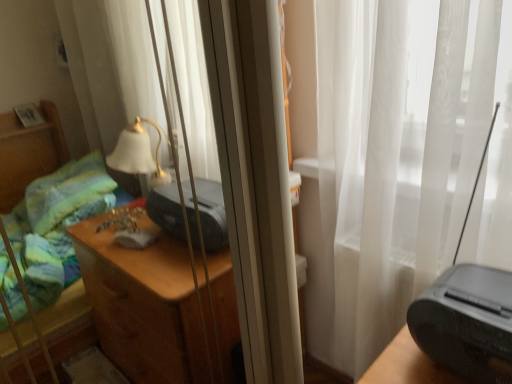
Question: From the image's perspective, is matte black printer at center, positioned as the 1th printer in left-to-right order, located above black plastic radio at right?

Choices:
 (A) yes
 (B) no

Answer: (A)

Question: Is matte black printer at center, arranged as the second printer when viewed from the front, positioned in front of black plastic radio at right?

Choices:
 (A) no
 (B) yes

Answer: (A)

Question: Does matte black printer at center, positioned as the 1th printer in left-to-right order, have a lesser height compared to black plastic radio at right?

Choices:
 (A) no
 (B) yes

Answer: (B)

Question: Is matte black printer at center, arranged as the second printer when viewed from the front, oriented away from black plastic radio at right?

Choices:
 (A) yes
 (B) no

Answer: (B)

Question: From a real-world perspective, is matte black printer at center, arranged as the 2th printer when viewed from the right, on top of black plastic radio at right?

Choices:
 (A) yes
 (B) no

Answer: (B)

Question: Relative to black plastic printer at right, which is counted as the 1th printer, starting from the front, is black plastic radio at right in front or behind?

Choices:
 (A) behind
 (B) front

Answer: (B)

Question: Considering the positions of black plastic radio at right and black plastic printer at right, which is counted as the 1th printer, starting from the front, in the image, is black plastic radio at right wider or thinner than black plastic printer at right, which is counted as the 1th printer, starting from the front,?

Choices:
 (A) wide
 (B) thin

Answer: (A)

Question: Is point (448, 365) closer or farther from the camera than point (450, 291)?

Choices:
 (A) farther
 (B) closer

Answer: (B)

Question: Is black plastic radio at right inside the boundaries of black plastic printer at right, which is the 1th printer from right to left, or outside?

Choices:
 (A) outside
 (B) inside

Answer: (A)

Question: In terms of height, does black plastic printer at right, positioned as the second printer in back-to-front order, look taller or shorter compared to white sheer curtain at center?

Choices:
 (A) tall
 (B) short

Answer: (B)

Question: From the image's perspective, is black plastic printer at right, positioned as the second printer in back-to-front order, above or below white sheer curtain at center?

Choices:
 (A) below
 (B) above

Answer: (A)

Question: Based on their positions, is black plastic printer at right, which is the 1th printer from right to left, located to the left or right of white sheer curtain at center?

Choices:
 (A) right
 (B) left

Answer: (A)

Question: Considering their positions, is black plastic printer at right, positioned as the second printer in back-to-front order, located in front of or behind white sheer curtain at center?

Choices:
 (A) front
 (B) behind

Answer: (A)

Question: Based on their positions, is black plastic radio at right located to the left or right of matte black printer at center, arranged as the second printer when viewed from the front?

Choices:
 (A) right
 (B) left

Answer: (A)

Question: Which is correct: black plastic radio at right is inside matte black printer at center, positioned as the 1th printer in left-to-right order, or outside of it?

Choices:
 (A) outside
 (B) inside

Answer: (A)